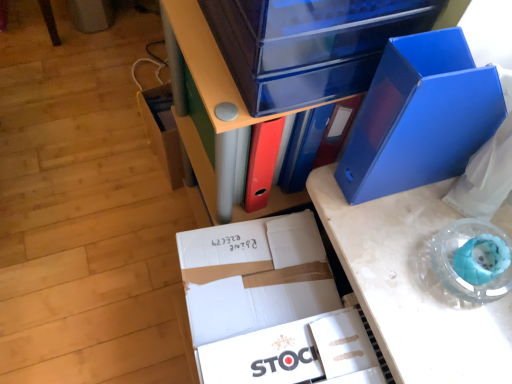
At what (x,y) coordinates should I click in order to perform the action: click on unoccupied area in front of blue plastic folder at upper right, positioned as the 2th paperback book in left-to-right order. Please return your answer as a coordinate pair (x, y). The image size is (512, 384). Looking at the image, I should click on (405, 266).